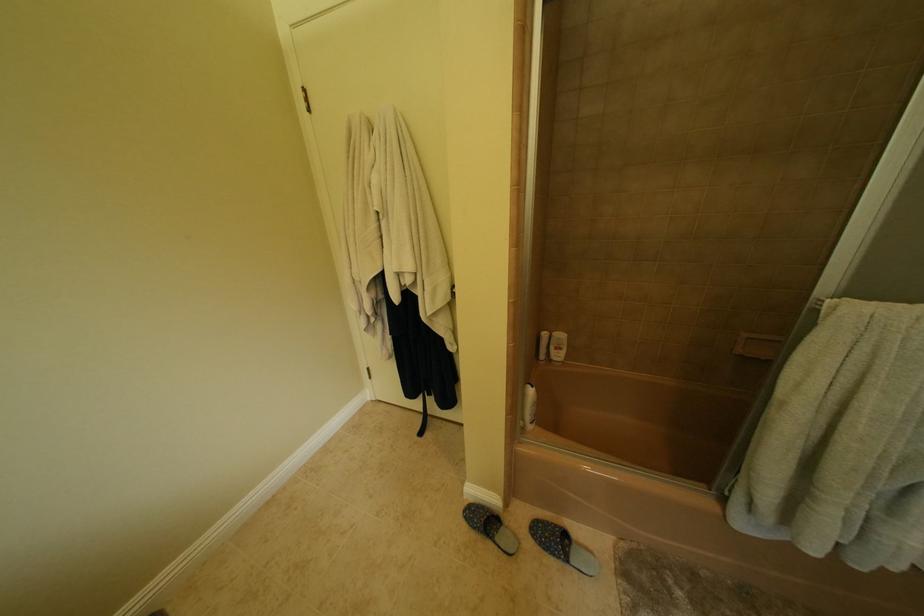
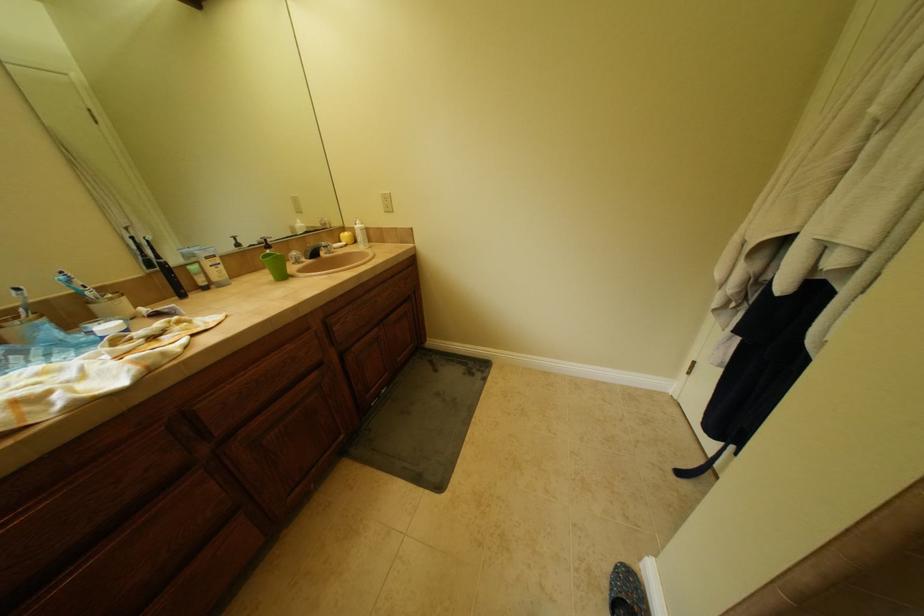
How did the camera likely rotate?

The rotation direction of the camera is left-down.